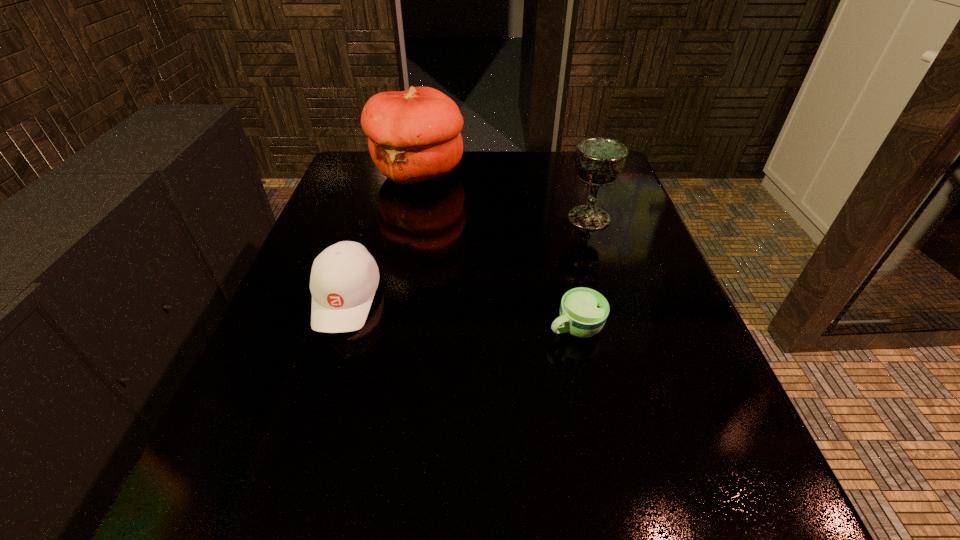
In the image, there is a desktop. Where is `free space at the near left corner`? The height and width of the screenshot is (540, 960). free space at the near left corner is located at coordinates (254, 500).

Image resolution: width=960 pixels, height=540 pixels. In order to click on vacant space at the far right corner of the desktop in this screenshot , I will do (x=585, y=185).

Image resolution: width=960 pixels, height=540 pixels. I want to click on free spot between the cup and the chalice, so click(x=582, y=273).

Locate an element on the screen. vacant point located between the second farthest object and the shortest object is located at coordinates (582, 273).

Find the location of a particular element. The width and height of the screenshot is (960, 540). free spot between the chalice and the third tallest object is located at coordinates (468, 258).

The height and width of the screenshot is (540, 960). Find the location of `unoccupied area between the tallest object and the third tallest object`. unoccupied area between the tallest object and the third tallest object is located at coordinates (382, 235).

This screenshot has height=540, width=960. I want to click on empty location between the second shortest object and the cup, so click(x=461, y=313).

You are a GUI agent. You are given a task and a screenshot of the screen. Output one action in this format:
    pyautogui.click(x=<x>, y=<y>)
    Task: Click on the free space between the pumpkin and the shortest object
    Image resolution: width=960 pixels, height=540 pixels.
    Given the screenshot: What is the action you would take?
    pyautogui.click(x=496, y=249)

At what (x,y) coordinates should I click in order to perform the action: click on vacant area that lies between the chalice and the tallest object. Please return your answer as a coordinate pair (x, y). This screenshot has width=960, height=540. Looking at the image, I should click on (503, 195).

Locate an element on the screen. vacant space that's between the farthest object and the shortest object is located at coordinates (496, 249).